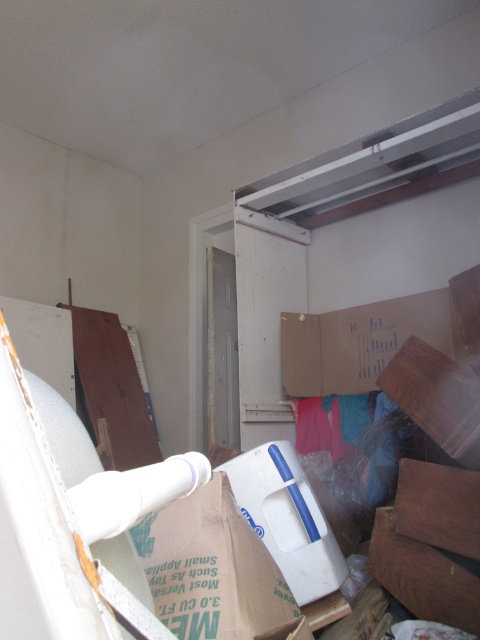
You are standing in the cluttered indoor space and need to move from your current position to the door frame in the background. There are two points marked on the floor at coordinates point (327, 376) and point (321, 522). Which point should you step on first to reach the door frame more directly?

You should step on point (321, 522) first because it is in front of point (327, 376), making it closer to your starting position and thus a more direct path towards the door frame in the background.